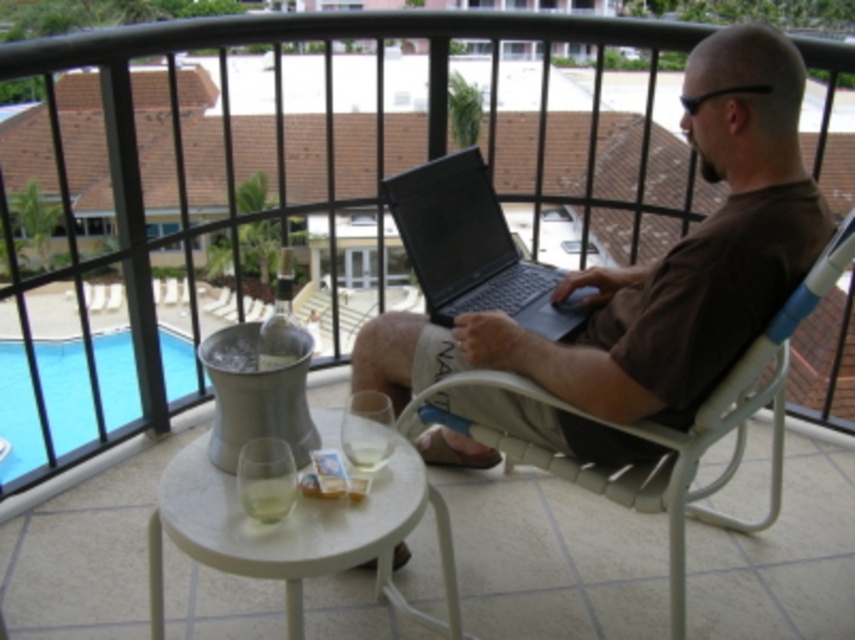
Question: Which point is closer to the camera?

Choices:
 (A) (87, 406)
 (B) (750, 314)

Answer: (B)

Question: Which is nearer to the brown cotton shirt at center?

Choices:
 (A) blue glass at lower left
 (B) white woven plastic chair at center
 (C) black matte laptop at center

Answer: (B)

Question: Is brown cotton shirt at center bigger than black matte laptop at center?

Choices:
 (A) yes
 (B) no

Answer: (A)

Question: Which is nearer to the white woven plastic chair at center?

Choices:
 (A) blue glass at lower left
 (B) brown cotton shirt at center
 (C) black matte laptop at center

Answer: (B)

Question: Does brown cotton shirt at center have a smaller size compared to black matte laptop at center?

Choices:
 (A) yes
 (B) no

Answer: (B)

Question: Does white woven plastic chair at center have a smaller size compared to black matte laptop at center?

Choices:
 (A) no
 (B) yes

Answer: (A)